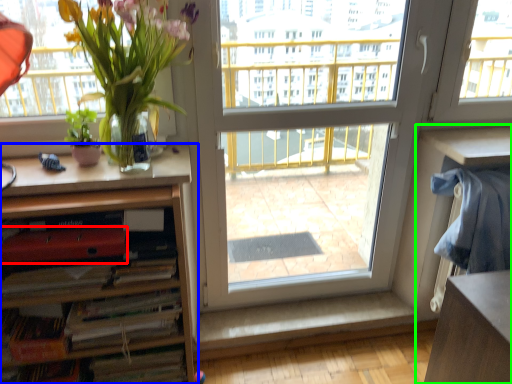
Question: Which object is positioned farthest from paperback book (highlighted by a red box)? Select from cabinetry (highlighted by a blue box) and computer desk (highlighted by a green box).

Choices:
 (A) cabinetry
 (B) computer desk

Answer: (B)